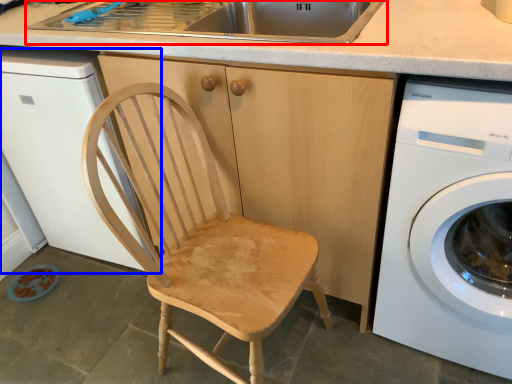
Question: Which point is closer to the camera, sink (highlighted by a red box) or dish washer (highlighted by a blue box)?

Choices:
 (A) sink
 (B) dish washer

Answer: (B)